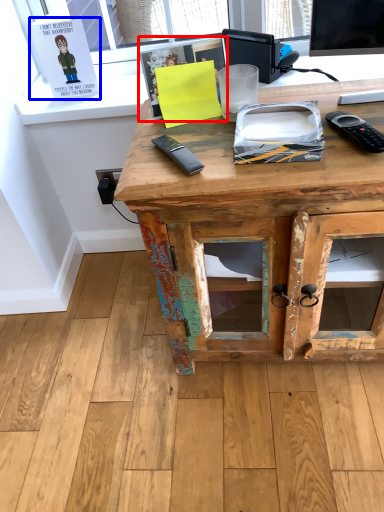
Question: Which object is closer to the camera taking this photo, book (highlighted by a red box) or book (highlighted by a blue box)?

Choices:
 (A) book
 (B) book

Answer: (A)